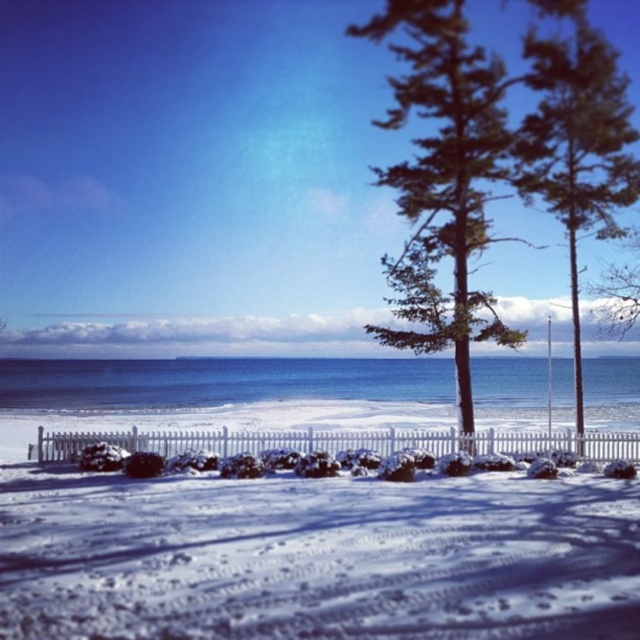
Between white snow at center and green needle-like foliage at upper right, which one has more height?

green needle-like foliage at upper right is taller.

Is point (362, 586) closer to viewer compared to point (592, 164)?

Yes, it is in front of point (592, 164).

You are a GUI agent. You are given a task and a screenshot of the screen. Output one action in this format:
    pyautogui.click(x=<x>, y=<y>)
    Task: Click on the white snow at center
    The height and width of the screenshot is (640, 640).
    Given the screenshot: What is the action you would take?
    pyautogui.click(x=317, y=556)

The width and height of the screenshot is (640, 640). Describe the element at coordinates (317, 556) in the screenshot. I see `white snow at center` at that location.

Which is more to the left, white snow at center or green needle-like foliage at center?

Positioned to the left is white snow at center.

Which is in front, point (476, 570) or point (499, 154)?

Point (476, 570)

I want to click on white snow at center, so click(x=317, y=556).

Does point (486, 227) come in front of point (545, 83)?

No, it is not.

Based on the photo, is green needle-like foliage at center positioned in front of green needle-like foliage at upper right?

Yes, green needle-like foliage at center is closer to the viewer.

Who is more forward, (426, 332) or (600, 145)?

Positioned in front is point (426, 332).

Locate an element on the screen. green needle-like foliage at center is located at coordinates (444, 182).